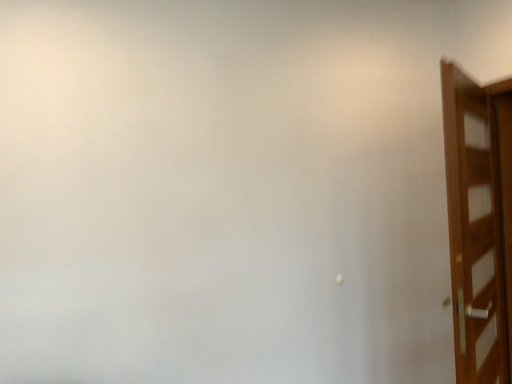
Where is `wooden door at right`? Image resolution: width=512 pixels, height=384 pixels. wooden door at right is located at coordinates (479, 223).

Describe the element at coordinates (479, 223) in the screenshot. This screenshot has height=384, width=512. I see `wooden door at right` at that location.

Identify the location of wooden door at right. This screenshot has height=384, width=512. (479, 223).